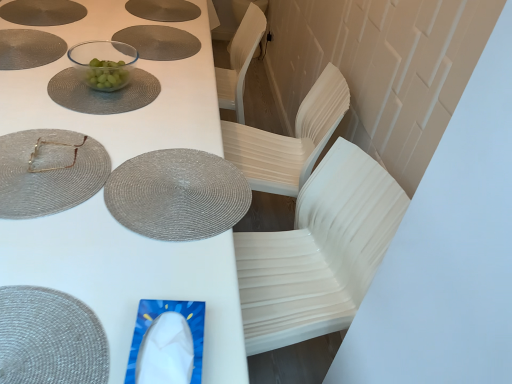
Image resolution: width=512 pixels, height=384 pixels. In order to click on vacant area that lies to the right of transparent glass bowl at upper center, which is the second glass plate from front to back in this screenshot , I will do `click(182, 104)`.